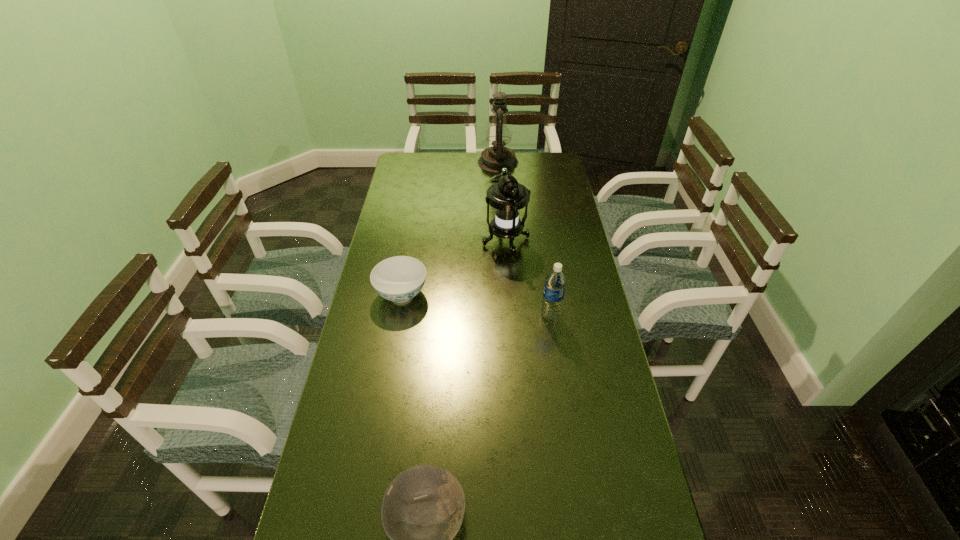
This screenshot has width=960, height=540. I want to click on blank space located 0.310m on the front of the second shortest object, so click(x=383, y=401).

Where is `object that is at the far edge`? This screenshot has width=960, height=540. object that is at the far edge is located at coordinates (493, 159).

Where is `object located at the left edge`? The height and width of the screenshot is (540, 960). object located at the left edge is located at coordinates (400, 278).

Find the location of a particular element. The width and height of the screenshot is (960, 540). object present at the right edge is located at coordinates [x=555, y=282].

Find the location of a particular element. This screenshot has width=960, height=540. free space at the far edge is located at coordinates (501, 173).

Find the location of a particular element. The height and width of the screenshot is (540, 960). vacant space at the left edge of the desktop is located at coordinates (333, 453).

The image size is (960, 540). Identify the location of free region at the right edge. (576, 269).

At what (x,y) coordinates should I click in order to perform the action: click on vacant region at the far right corner of the desktop. Please return your answer as a coordinate pair (x, y). Image resolution: width=960 pixels, height=540 pixels. Looking at the image, I should click on (545, 161).

Find the location of a particular element. empty location between the fourth tallest object and the lantern is located at coordinates (454, 268).

The width and height of the screenshot is (960, 540). I want to click on empty space that is in between the tallest object and the fourth tallest object, so click(450, 228).